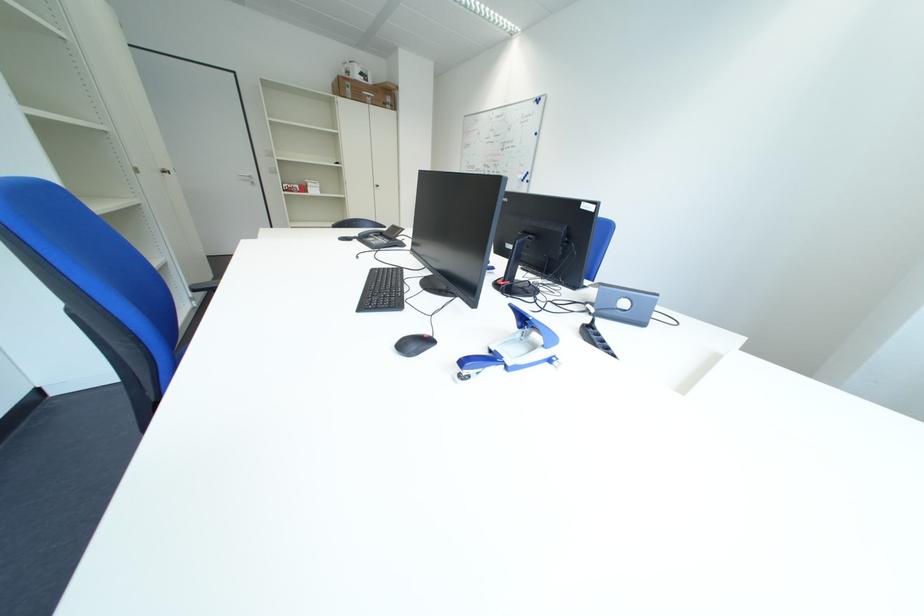
Where would you slid the black computer mouse? Please return your answer as a coordinate pair (x, y).

(414, 344)